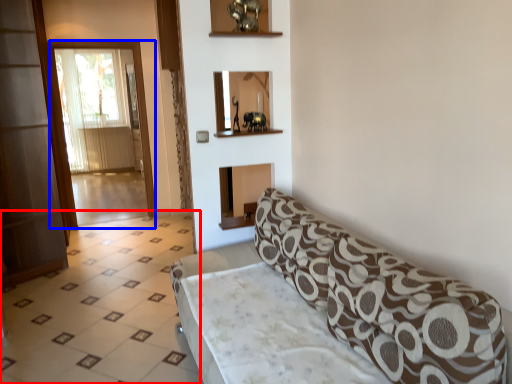
Question: Among these objects, which one is nearest to the camera, tile (highlighted by a red box) or screen door (highlighted by a blue box)?

Choices:
 (A) tile
 (B) screen door

Answer: (A)